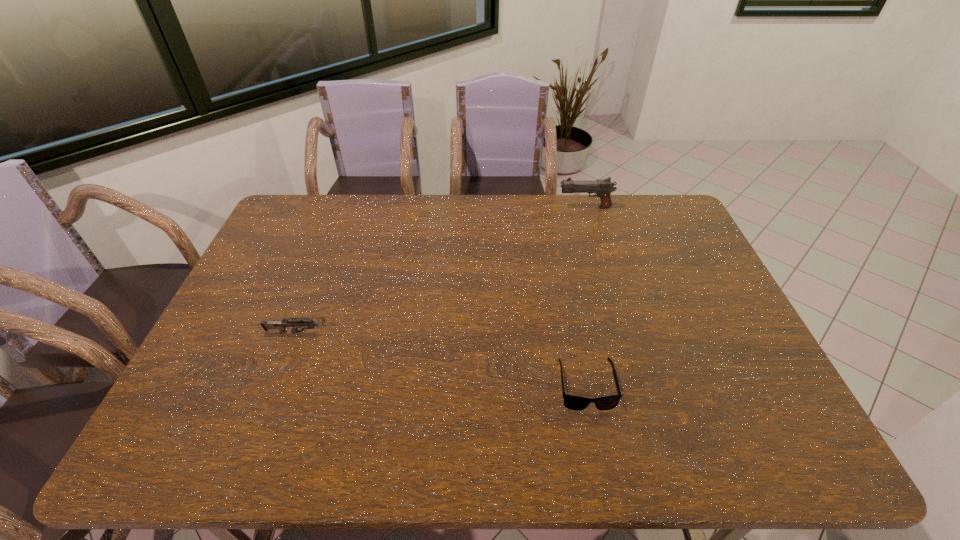
This screenshot has width=960, height=540. In order to click on free space between the tallest object and the nearer gun in this screenshot , I will do [444, 270].

Locate an element on the screen. This screenshot has width=960, height=540. free space between the tallest object and the leftmost object is located at coordinates (444, 270).

Where is `empty space that is in between the shorter gun and the farthest object`? The image size is (960, 540). empty space that is in between the shorter gun and the farthest object is located at coordinates (444, 270).

Identify the location of free space between the sunglasses and the tallest object. (586, 296).

I want to click on unoccupied position between the nearer gun and the farthest object, so click(444, 270).

At what (x,y) coordinates should I click in order to perform the action: click on free space between the nearer gun and the taller gun. Please return your answer as a coordinate pair (x, y). Looking at the image, I should click on (444, 270).

You are a GUI agent. You are given a task and a screenshot of the screen. Output one action in this format:
    pyautogui.click(x=<x>, y=<y>)
    Task: Click on the free area in between the leftmost object and the farthest object
    The height and width of the screenshot is (540, 960).
    Given the screenshot: What is the action you would take?
    pyautogui.click(x=444, y=270)

Locate an element on the screen. free area in between the shortest object and the second nearest object is located at coordinates (x=444, y=359).

Choose which object is the nearest neighbor to the taller gun. Please provide its 2D coordinates. Your answer should be formatted as a tuple, i.e. [(x, y)], where the tuple contains the x and y coordinates of a point satisfying the conditions above.

[(577, 403)]

At what (x,y) coordinates should I click in order to perform the action: click on the second closest object to the farther gun. Please return your answer as a coordinate pair (x, y). Looking at the image, I should click on point(279,325).